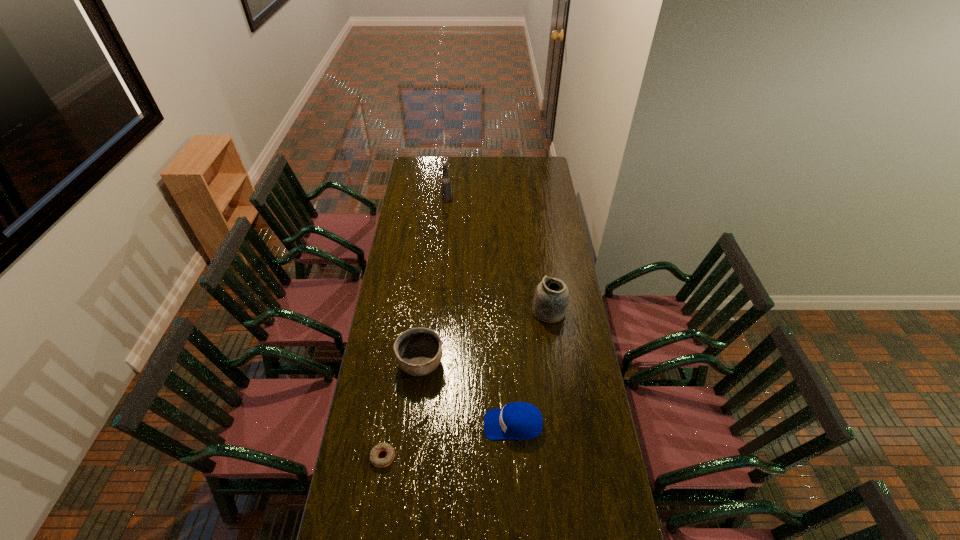
Where is `free point between the second shortest object and the shortest object`? Image resolution: width=960 pixels, height=540 pixels. free point between the second shortest object and the shortest object is located at coordinates (448, 441).

Where is `unoccupied area between the farthest object and the shortest object`? The height and width of the screenshot is (540, 960). unoccupied area between the farthest object and the shortest object is located at coordinates (415, 328).

This screenshot has width=960, height=540. In order to click on free space between the rightmost object and the shortest object in this screenshot , I will do `click(467, 384)`.

Choose which object is the nearest neighbor to the baseball cap. Please provide its 2D coordinates. Your answer should be formatted as a tuple, i.e. [(x, y)], where the tuple contains the x and y coordinates of a point satisfying the conditions above.

[(418, 351)]

Find the location of a particular element. This screenshot has width=960, height=540. the fourth closest object to the fourth farthest object is located at coordinates coord(446,193).

Locate an element on the screen. blank area in the image that satisfies the following two spatial constraints: 1. on the side of the right pottery with the label; 2. on the left side of the beer bottle is located at coordinates (437, 312).

Locate an element on the screen. Image resolution: width=960 pixels, height=540 pixels. free space in the image that satisfies the following two spatial constraints: 1. on the front-facing side of the fourth object from left to right; 2. on the front side of the doughnut is located at coordinates point(516,457).

You are a GUI agent. You are given a task and a screenshot of the screen. Output one action in this format:
    pyautogui.click(x=<x>, y=<y>)
    Task: Click on the vacant space that satisfies the following two spatial constraints: 1. on the side of the farthest object with the label; 2. on the left side of the second tallest object
    
    Given the screenshot: What is the action you would take?
    pyautogui.click(x=437, y=312)

You are a GUI agent. You are given a task and a screenshot of the screen. Output one action in this format:
    pyautogui.click(x=<x>, y=<y>)
    Task: Click on the free spot that satisfies the following two spatial constraints: 1. on the back side of the third farthest object; 2. on the right side of the rightmost object
    Image resolution: width=960 pixels, height=540 pixels.
    Given the screenshot: What is the action you would take?
    pyautogui.click(x=426, y=312)